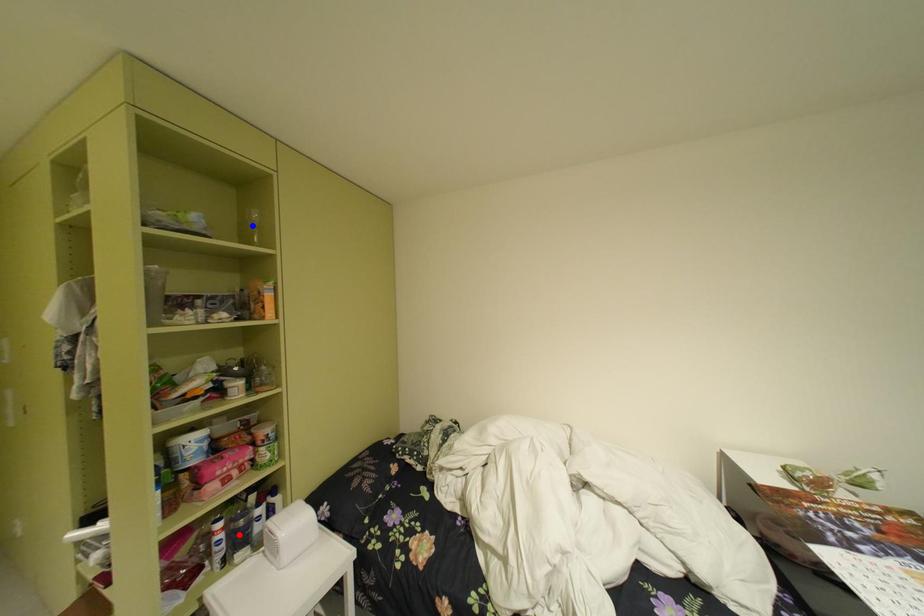
Question: Which of the two points in the image is closer to the camera?

Choices:
 (A) Blue point is closer.
 (B) Red point is closer.

Answer: (B)